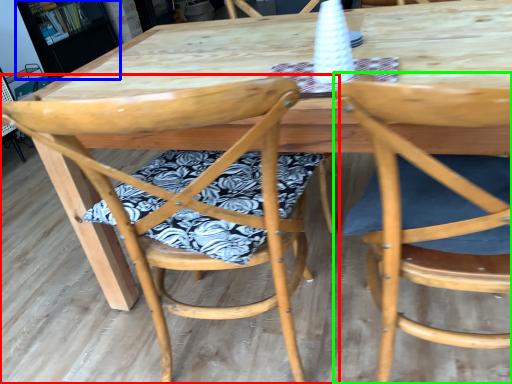
Question: Estimate the real-world distances between objects in this image. Which object is closer to chair (highlighted by a red box), bookshelf (highlighted by a blue box) or chair (highlighted by a green box)?

Choices:
 (A) bookshelf
 (B) chair

Answer: (B)